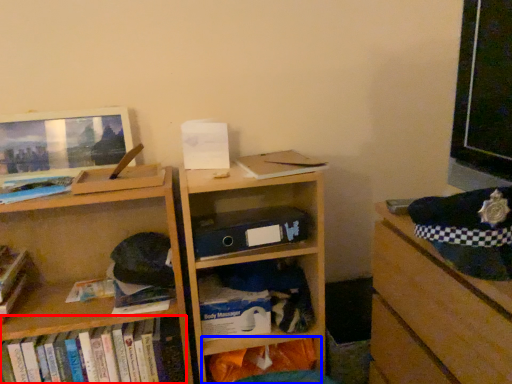
Question: Which of the following is the farthest to the observer, book (highlighted by a red box) or shelf (highlighted by a blue box)?

Choices:
 (A) book
 (B) shelf

Answer: (B)